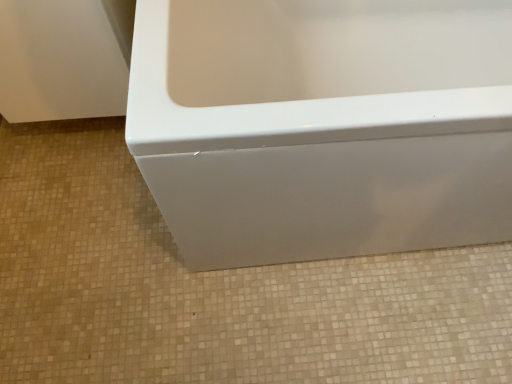
The width and height of the screenshot is (512, 384). I want to click on vacant space situated above white glossy bathtub at lower center (from a real-world perspective), so click(151, 269).